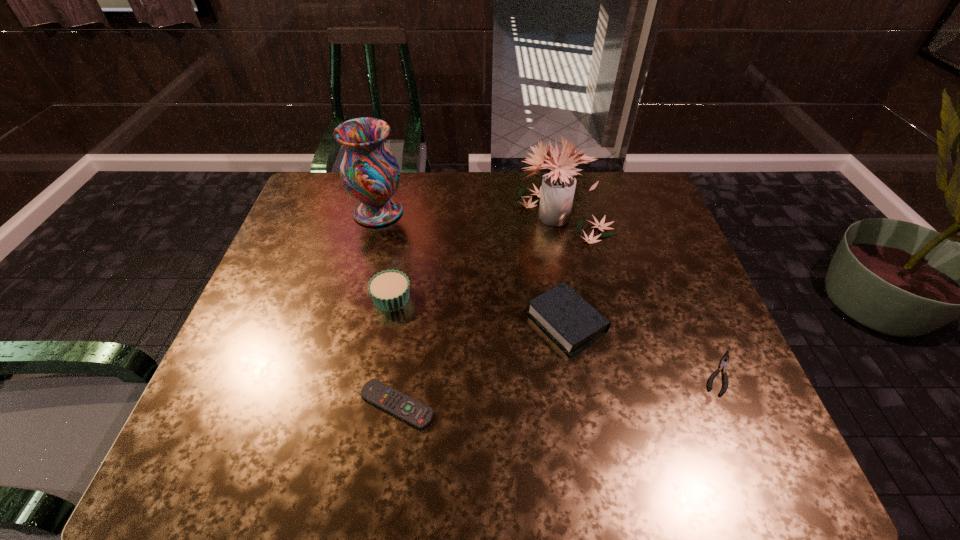
Identify the location of vase. (369, 172).

Where is `bouquet`? Image resolution: width=960 pixels, height=540 pixels. bouquet is located at coordinates [556, 194].

Locate an element on the screen. cupcake is located at coordinates (389, 290).

Find the location of a particular element. This screenshot has width=960, height=540. the third shortest object is located at coordinates (561, 312).

Find the location of a particular element. The width and height of the screenshot is (960, 540). remote control is located at coordinates (404, 407).

The image size is (960, 540). I want to click on pliers, so click(x=724, y=362).

The height and width of the screenshot is (540, 960). In order to click on the rightmost object in this screenshot , I will do `click(724, 362)`.

The image size is (960, 540). Find the location of `free space located 0.090m on the front of the vase`. free space located 0.090m on the front of the vase is located at coordinates (369, 250).

Where is `free spot located 0.240m on the left of the bouquet`? The width and height of the screenshot is (960, 540). free spot located 0.240m on the left of the bouquet is located at coordinates (437, 216).

Find the location of `free space located on the front of the cupcake`. free space located on the front of the cupcake is located at coordinates (365, 442).